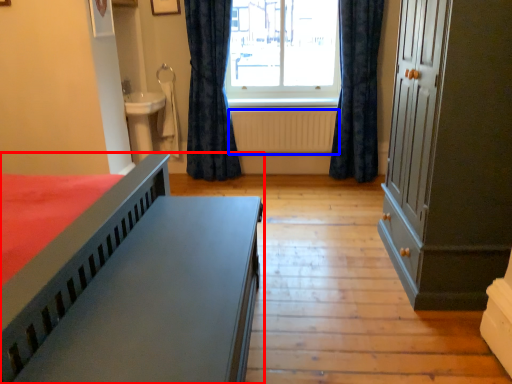
Question: Which of the following is the farthest to the observer, bed (highlighted by a red box) or radiator (highlighted by a blue box)?

Choices:
 (A) bed
 (B) radiator

Answer: (B)